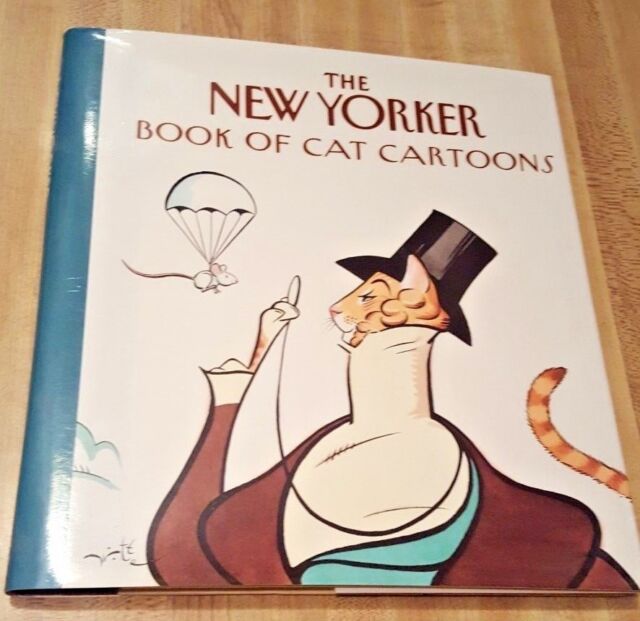
Find the location of a particular element. The image size is (640, 621). blue spine on book is located at coordinates (89, 55), (79, 156), (70, 254), (51, 374), (38, 477).